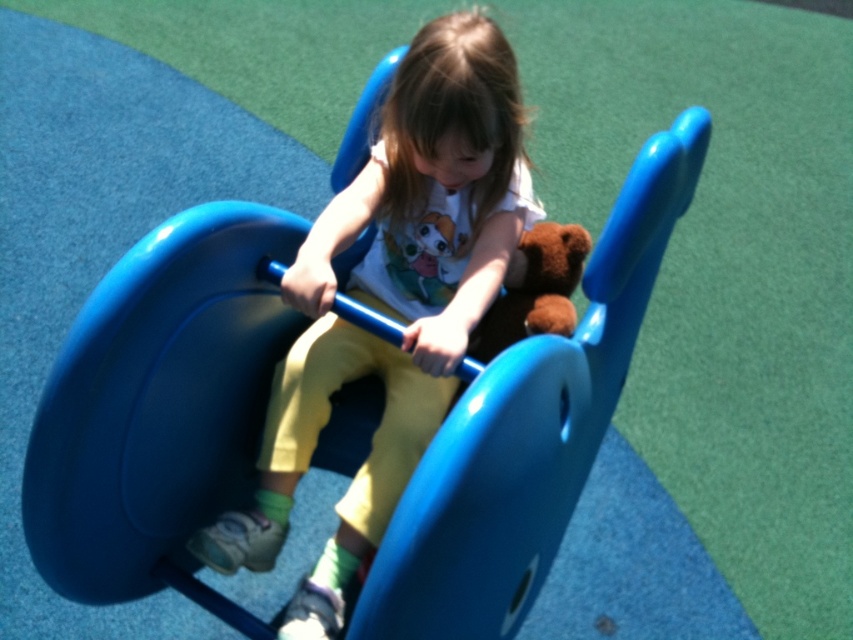
Question: Observing the image, what is the correct spatial positioning of blue glossy slide at center in reference to matte plastic child at center?

Choices:
 (A) above
 (B) below

Answer: (B)

Question: Does blue glossy slide at center appear over brown plush at center?

Choices:
 (A) yes
 (B) no

Answer: (B)

Question: Estimate the real-world distances between objects in this image. Which object is farther from the blue glossy slide at center?

Choices:
 (A) brown plush at center
 (B) matte plastic child at center

Answer: (B)

Question: Based on their relative distances, which object is nearer to the blue glossy slide at center?

Choices:
 (A) brown plush at center
 (B) matte plastic child at center

Answer: (A)

Question: Does blue glossy slide at center appear under brown plush at center?

Choices:
 (A) no
 (B) yes

Answer: (B)

Question: Which object appears closest to the camera in this image?

Choices:
 (A) brown plush at center
 (B) blue glossy slide at center

Answer: (B)